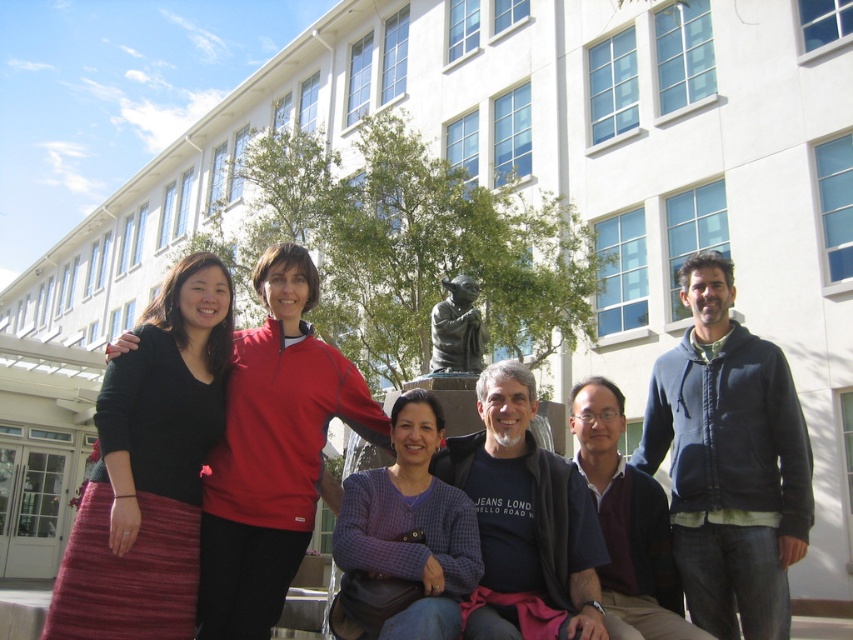
Question: Which of the following is the farthest from the observer?

Choices:
 (A) bronze statue at center
 (B) black knit skirt at left
 (C) purple checkered sweater at center
 (D) matte red jacket at center

Answer: (A)

Question: Among these points, which one is nearest to the camera?

Choices:
 (A) (352, 525)
 (B) (279, 474)

Answer: (A)

Question: Does purple checkered sweater at center appear on the left side of bronze statue at center?

Choices:
 (A) yes
 (B) no

Answer: (A)

Question: Does black knit skirt at left have a greater width compared to purple checkered sweater at center?

Choices:
 (A) yes
 (B) no

Answer: (B)

Question: Considering the real-world distances, which object is farthest from the purple checkered sweater at center?

Choices:
 (A) matte red jacket at center
 (B) black knit skirt at left

Answer: (B)

Question: Is purple checkered sweater at center wider than bronze statue at center?

Choices:
 (A) no
 (B) yes

Answer: (B)